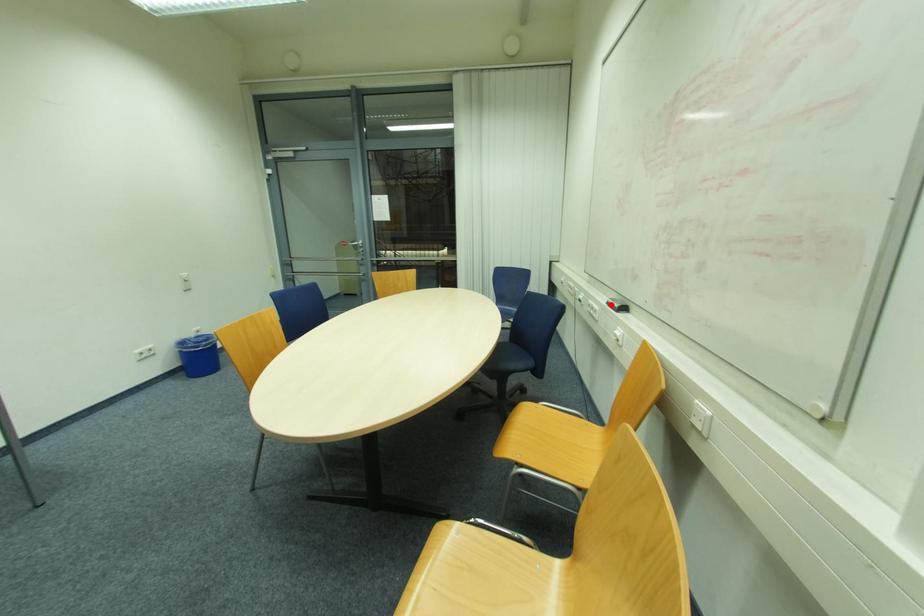
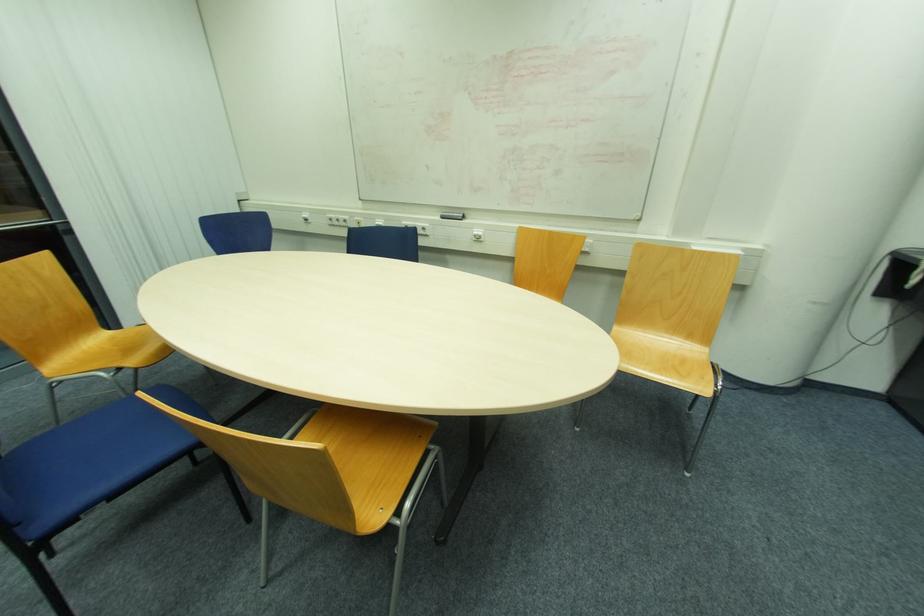
The point at the highlighted location is marked in the first image. Where is the corresponding point in the second image?

(444, 217)